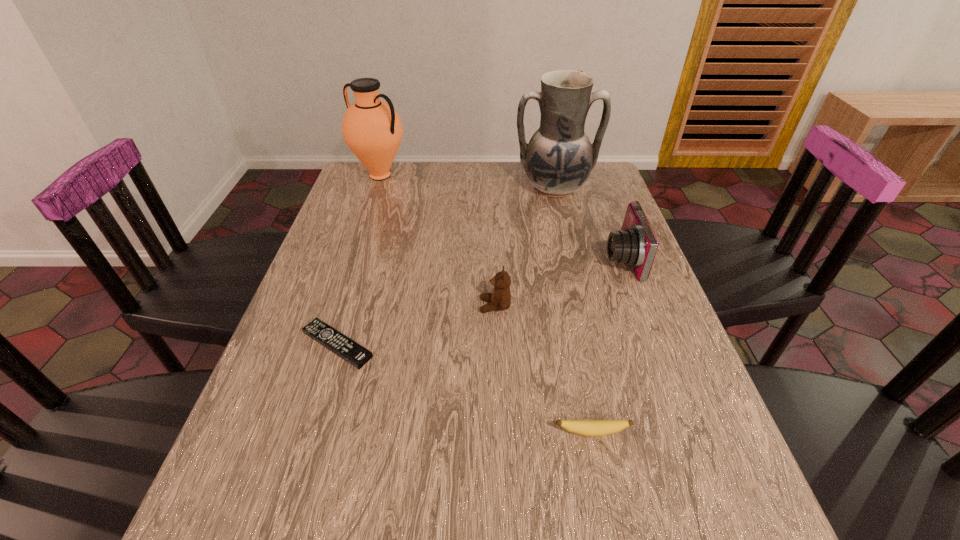
At what (x,y) coordinates should I click in order to perform the action: click on object that stands as the closest to the left pitcher. Please return your answer as a coordinate pair (x, y). This screenshot has width=960, height=540. Looking at the image, I should click on 558,160.

Locate an element on the screen. The image size is (960, 540). object that can be found as the closest to the second shortest object is located at coordinates (500, 299).

Where is `free space that satisfies the following two spatial constraints: 1. at the face of the teddy bear; 2. on the left side of the nearest object`? The height and width of the screenshot is (540, 960). free space that satisfies the following two spatial constraints: 1. at the face of the teddy bear; 2. on the left side of the nearest object is located at coordinates (499, 433).

The height and width of the screenshot is (540, 960). What are the coordinates of `free space in the image that satisfies the following two spatial constraints: 1. on the front-facing side of the right pitcher; 2. at the face of the teddy bear` in the screenshot? It's located at (582, 306).